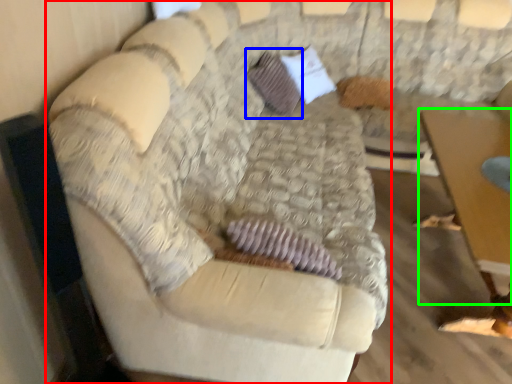
Question: Estimate the real-world distances between objects in this image. Which object is farther from studio couch (highlighted by a red box), pillow (highlighted by a blue box) or table (highlighted by a green box)?

Choices:
 (A) pillow
 (B) table

Answer: (A)